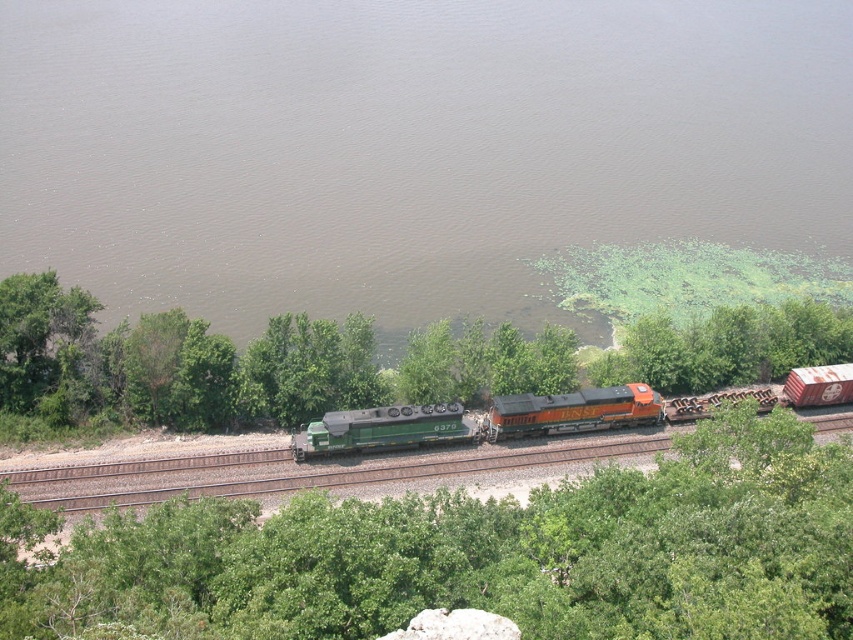
Based on the photo, you are a photographer standing on the platform next to the tracks. You want to capture a photo of the green matte train at center and the orange glossy locomotive at center. Which one will appear taller in your photo?

The green matte train at center will appear taller in the photo because it has a greater height compared to the orange glossy locomotive at center.

You are standing on the platform next to the water, looking at the green matte train at center and the green matte train car at center. Which one is positioned more to the right side?

The green matte train at center is positioned more to the right side than the green matte train car at center.

You are a railway engineer observing the scene. The green matte train at center is positioned at coordinates 0.658 on the x and 0.563 on the y. If you need to place a safety marker exactly 0.2 units to the right of the train along the x axis, what would be the new x coordinate of the safety marker?

The new x coordinate would be 0.658 plus 0.2, which equals 0.858. Therefore, the safety marker should be placed at x coordinate 0.858 while maintaining the y coordinate at 0.563.